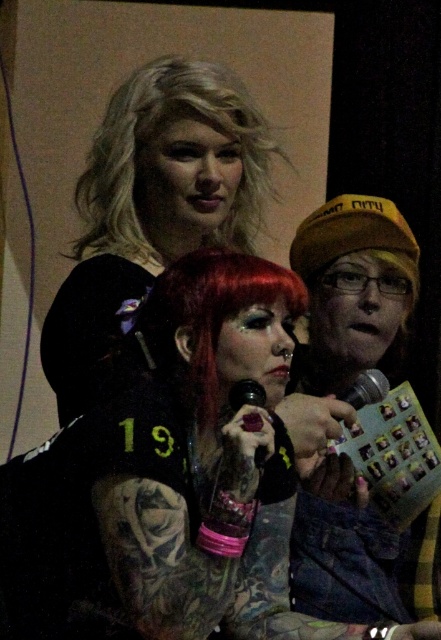
Question: Which object is farther from the camera taking this photo?

Choices:
 (A) metallic silver microphone at center
 (B) blondehair at upper center
 (C) translucent plastic microphone at center

Answer: (B)

Question: In this image, where is black matte cap at right located relative to shiny red hair at center?

Choices:
 (A) below
 (B) above

Answer: (A)

Question: Can you confirm if metallic silver microphone at center is wider than translucent plastic microphone at center?

Choices:
 (A) no
 (B) yes

Answer: (B)

Question: Which point is farther from the camera taking this photo?

Choices:
 (A) (366, 369)
 (B) (157, 250)
 (C) (228, 275)

Answer: (A)

Question: Which object appears closest to the camera in this image?

Choices:
 (A) shiny red hair at center
 (B) black matte cap at right

Answer: (A)

Question: Is blondehair at upper center to the left of shiny red hair at center from the viewer's perspective?

Choices:
 (A) no
 (B) yes

Answer: (B)